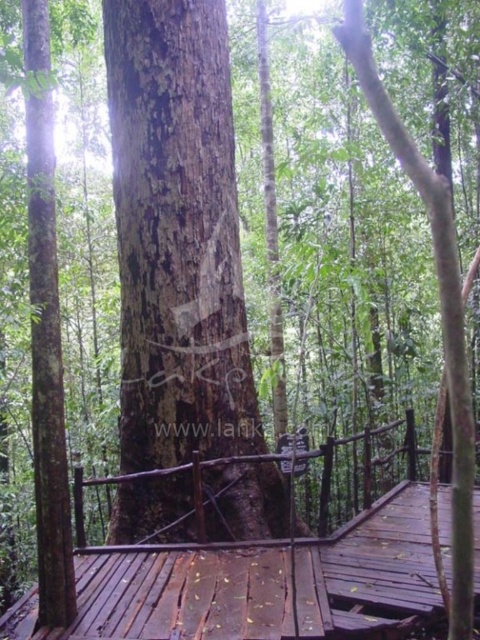
Based on the photo, you are a park ranger who needs to cross the brown wooden bridge at center. However, you notice the brown rough tree trunk at center nearby. Which structure is bigger in size?

The brown wooden bridge at center is larger in size than the brown rough tree trunk at center.

You are standing on the wooden walkway in the forest scene and notice a specific point marked at coordinates (177, 236). What does this point indicate?

The point at coordinates (177, 236) marks the location of the dark brown rough bark tree trunk at center.

You are a park ranger assessing the forest layout. You see the dark brown rough bark tree trunk at center and the brown rough tree trunk at center. Which tree trunk is taller?

The dark brown rough bark tree trunk at center is much taller than the brown rough tree trunk at center.